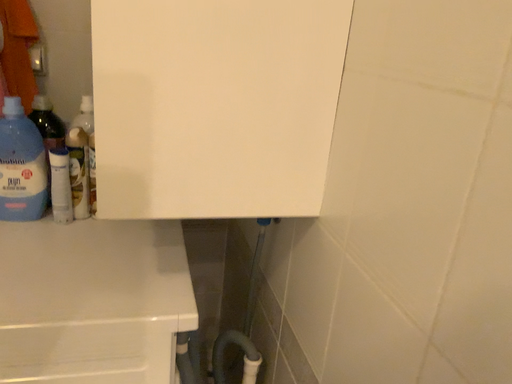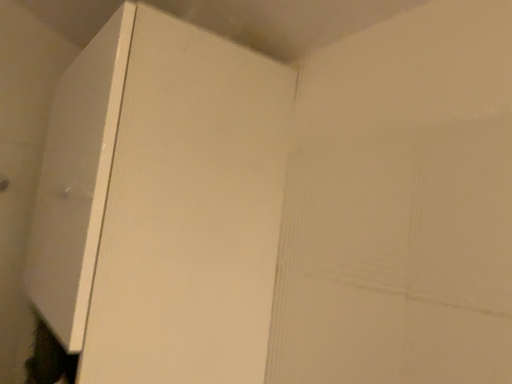
Question: How did the camera likely rotate when shooting the video?

Choices:
 (A) rotated downward
 (B) rotated upward

Answer: (B)